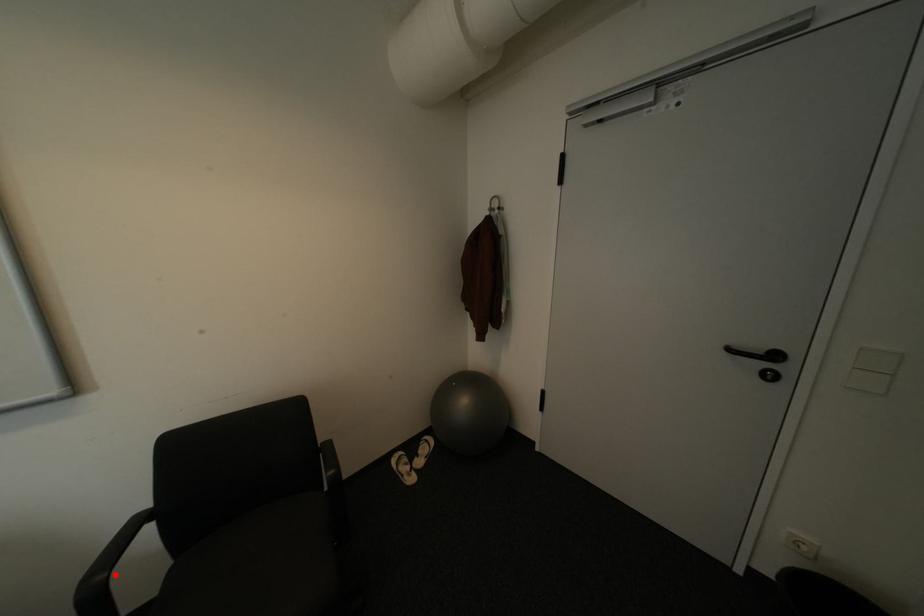
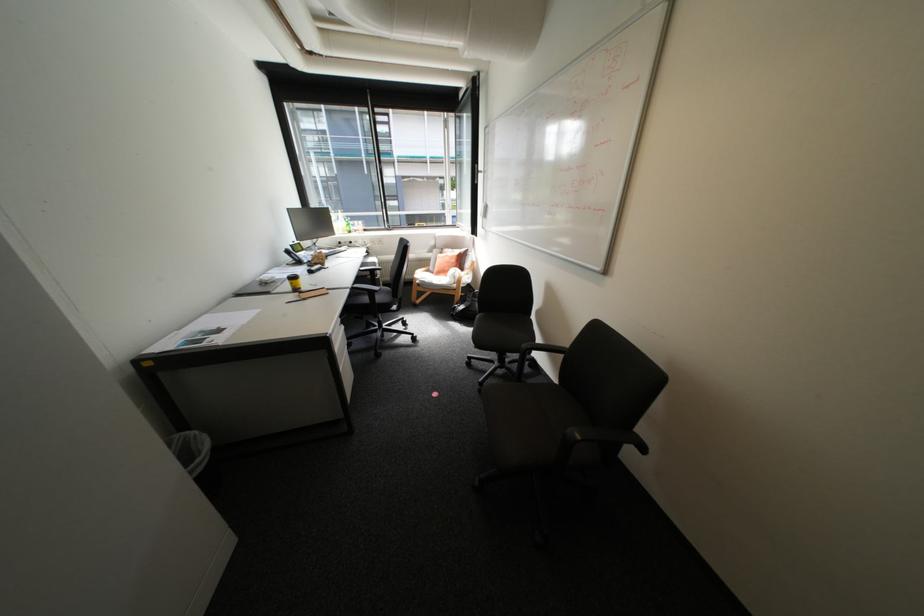
Question: I am providing you with two images of the same scene from different viewpoints. In image1, a red point is highlighted. Considering the same 3D point in image2, which of the following is correct?

Choices:
 (A) It is closer
 (B) It is farther

Answer: (B)